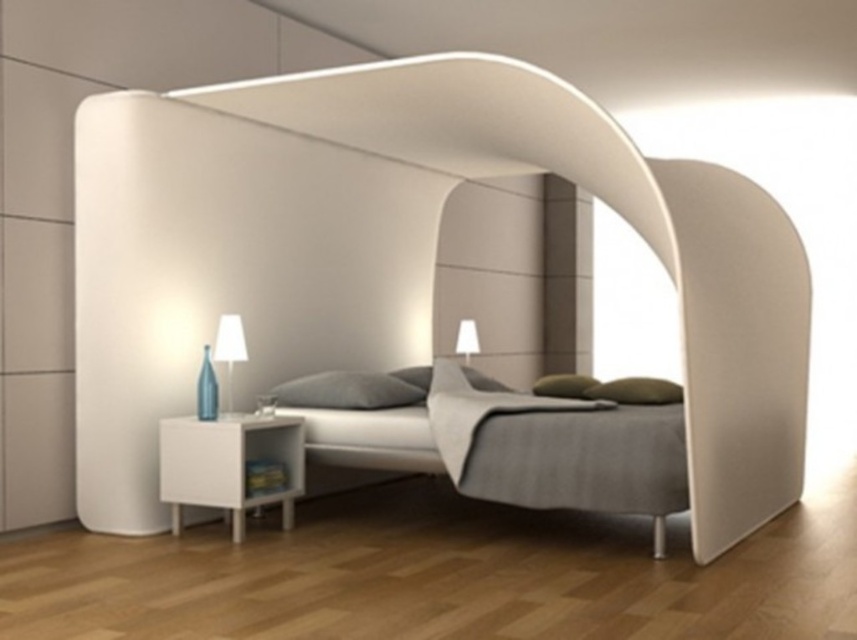
Question: Is gray fabric bed at center closer to camera compared to white matte hardwood at lower left?

Choices:
 (A) no
 (B) yes

Answer: (B)

Question: Is matte glass lamp at left wider than green fabric pillow at center?

Choices:
 (A) yes
 (B) no

Answer: (B)

Question: Which of the following is the closest to the observer?

Choices:
 (A) (596, 483)
 (B) (427, 378)
 (C) (259, 385)

Answer: (A)

Question: Which point appears closest to the camera in this image?

Choices:
 (A) (460, 336)
 (B) (231, 388)
 (C) (552, 380)

Answer: (B)

Question: Which point appears closest to the camera in this image?

Choices:
 (A) (496, 384)
 (B) (387, 397)
 (C) (147, 518)
 (D) (238, 353)

Answer: (C)

Question: Is gray fabric bed at center above matte glass lamp at left?

Choices:
 (A) no
 (B) yes

Answer: (A)